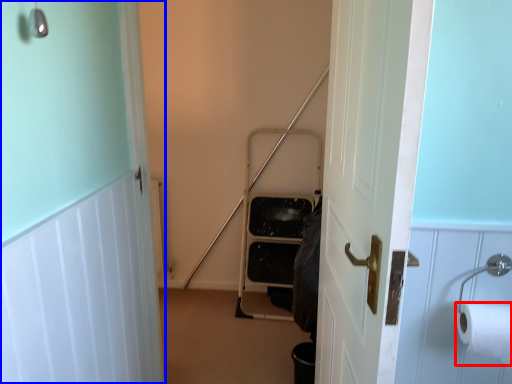
Question: Among these objects, which one is farthest to the camera, toilet paper (highlighted by a red box) or door (highlighted by a blue box)?

Choices:
 (A) toilet paper
 (B) door

Answer: (A)